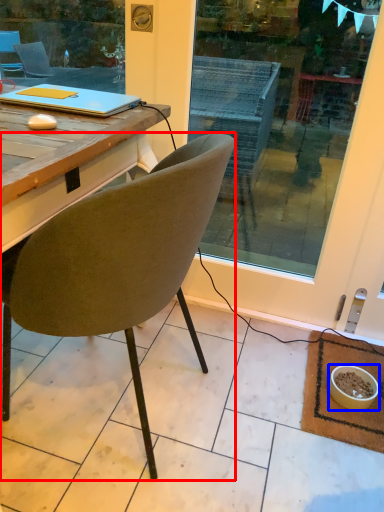
Question: Among these objects, which one is farthest to the camera, chair (highlighted by a red box) or bowl (highlighted by a blue box)?

Choices:
 (A) chair
 (B) bowl

Answer: (B)